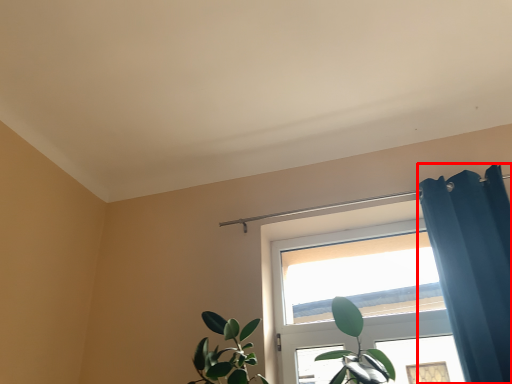
Question: From the image's perspective, where is shower curtain (annotated by the red box) located relative to window?

Choices:
 (A) below
 (B) above

Answer: (B)